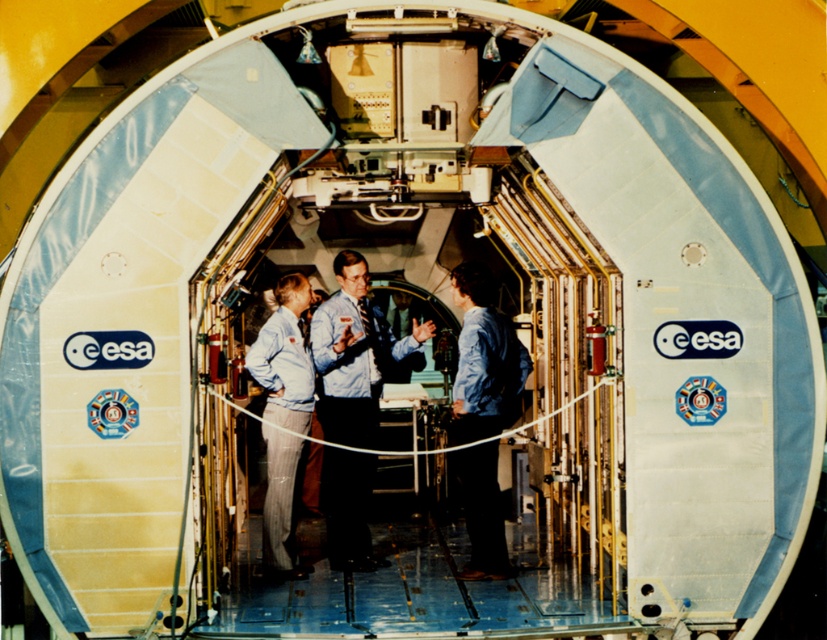
Question: Is blue shirt at center closer to camera compared to light blue fabric pants at center?

Choices:
 (A) yes
 (B) no

Answer: (B)

Question: Among these objects, which one is farthest from the camera?

Choices:
 (A) blue denim shirt at center
 (B) blue shirt at center

Answer: (B)

Question: Does blue shirt at center have a larger size compared to light blue fabric pants at center?

Choices:
 (A) yes
 (B) no

Answer: (A)

Question: Which point appears farthest from the camera in this image?

Choices:
 (A) (503, 384)
 (B) (281, 276)
 (C) (370, 381)

Answer: (B)

Question: Considering the relative positions of blue denim shirt at center and light blue fabric pants at center in the image provided, where is blue denim shirt at center located with respect to light blue fabric pants at center?

Choices:
 (A) right
 (B) left

Answer: (A)

Question: Estimate the real-world distances between objects in this image. Which object is farther from the blue shirt at center?

Choices:
 (A) blue denim shirt at center
 (B) light blue fabric pants at center

Answer: (A)